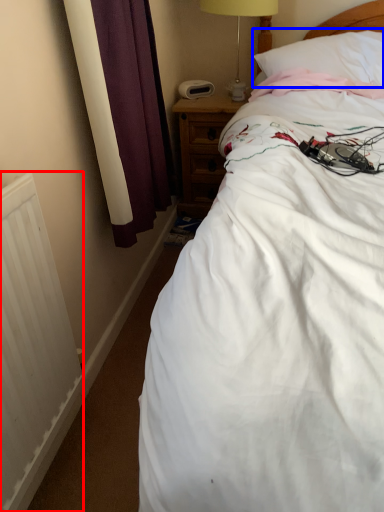
Question: Which of the following is the closest to the observer, radiator (highlighted by a red box) or pillow (highlighted by a blue box)?

Choices:
 (A) radiator
 (B) pillow

Answer: (A)